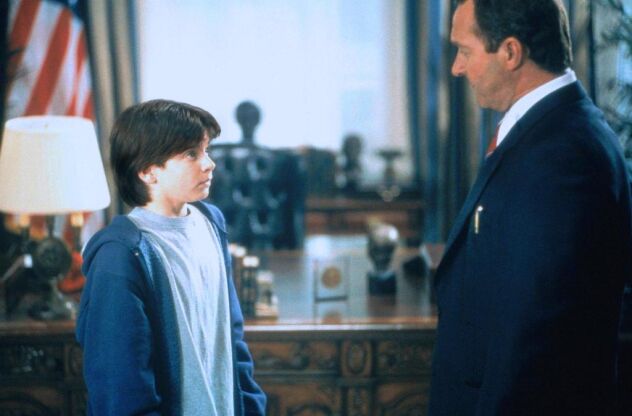
Identify the location of chair. (267, 158).